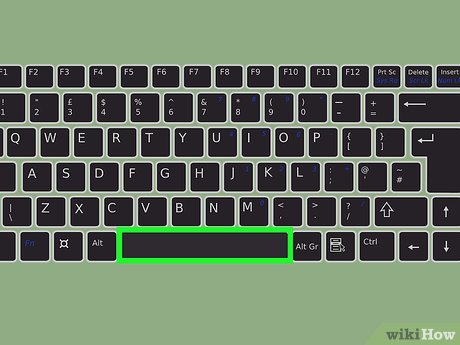
Where is `0 - 9 number keys on keyboard`? The image size is (460, 345). 0 - 9 number keys on keyboard is located at coordinates (12, 106), (41, 110), (76, 109), (112, 105), (142, 105), (172, 104), (205, 100), (245, 103), (275, 102), (307, 105).